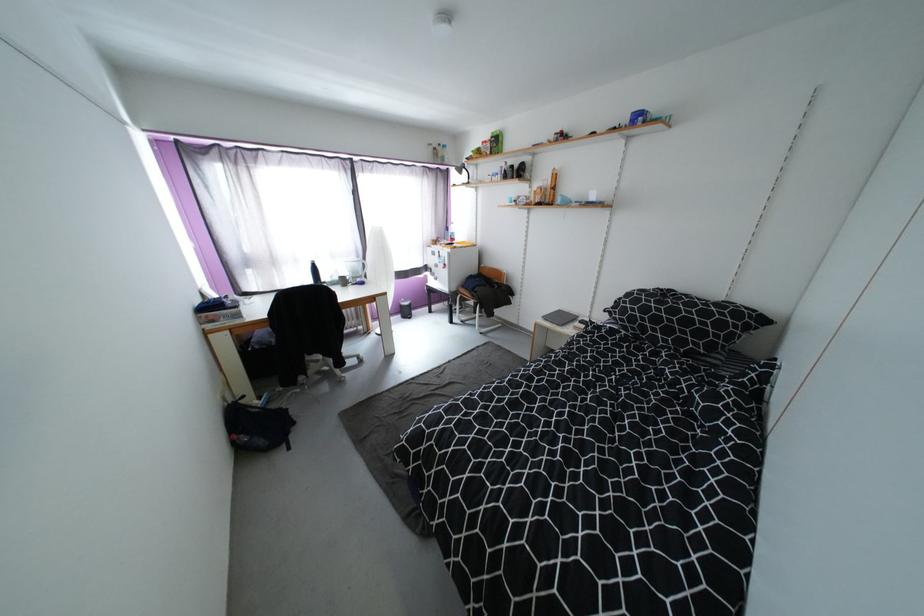
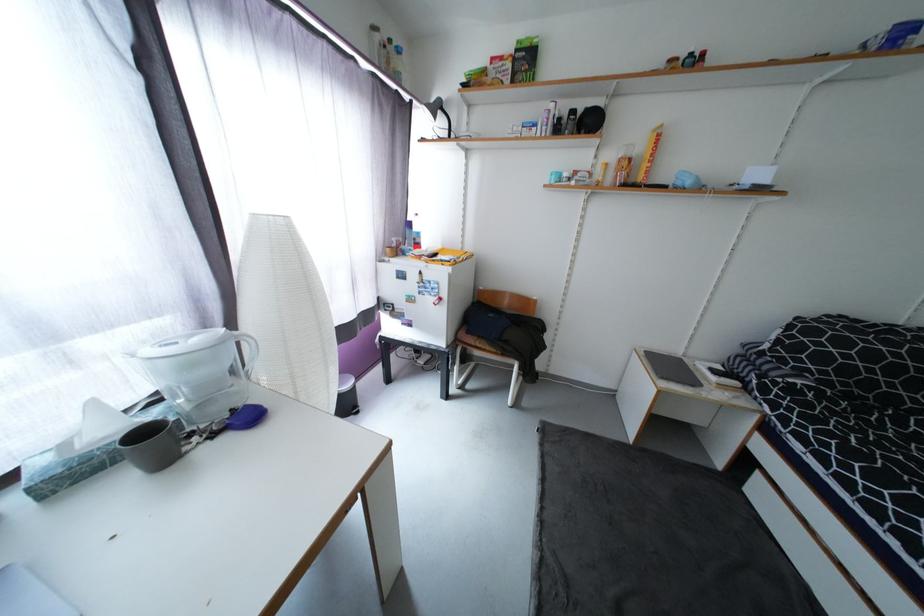
In the second image, find the point that corresponds to point (443, 256) in the first image.

(419, 278)